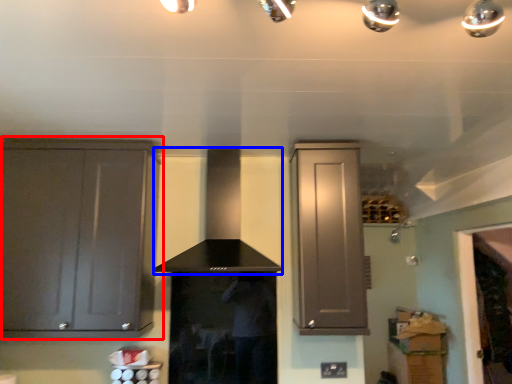
Question: Which object appears closest to the camera in this image, cabinetry (highlighted by a red box) or vent (highlighted by a blue box)?

Choices:
 (A) cabinetry
 (B) vent

Answer: (B)